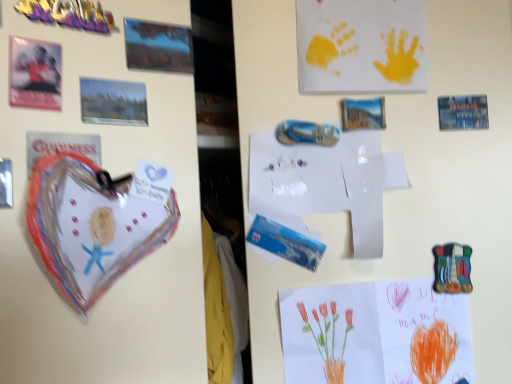
Question: Does watercolor paper flowers at lower right, the 5th postcard from the left, touch matte plastic postcard at upper left, the third postcard positioned from the top?

Choices:
 (A) no
 (B) yes

Answer: (A)

Question: From a real-world perspective, is watercolor paper flowers at lower right, which is the fifth postcard in top-to-bottom order, located beneath matte plastic postcard at upper left, the third postcard ordered from the bottom?

Choices:
 (A) no
 (B) yes

Answer: (B)

Question: Considering the relative positions of watercolor paper flowers at lower right, placed as the 4th postcard when sorted from front to back, and matte plastic postcard at upper left, which ranks as the 5th postcard in back-to-front order, in the image provided, is watercolor paper flowers at lower right, placed as the 4th postcard when sorted from front to back, behind matte plastic postcard at upper left, which ranks as the 5th postcard in back-to-front order,?

Choices:
 (A) no
 (B) yes

Answer: (B)

Question: Considering the relative sizes of watercolor paper flowers at lower right, the 5th postcard from the left, and matte plastic postcard at upper left, the fifth postcard viewed from the right, in the image provided, is watercolor paper flowers at lower right, the 5th postcard from the left, shorter than matte plastic postcard at upper left, the fifth postcard viewed from the right,?

Choices:
 (A) yes
 (B) no

Answer: (B)

Question: Can you confirm if watercolor paper flowers at lower right, which is the fifth postcard in top-to-bottom order, is positioned to the left of matte plastic postcard at upper left, the fifth postcard viewed from the right?

Choices:
 (A) no
 (B) yes

Answer: (A)

Question: Which is correct: metallic postcard at upper left, which is the 3th postcard in left-to-right order, is inside metallic/metallic stickers at upper left, or outside of it?

Choices:
 (A) inside
 (B) outside

Answer: (B)

Question: From the image's perspective, is metallic postcard at upper left, the 3th postcard when ordered from front to back, above or below metallic/metallic stickers at upper left?

Choices:
 (A) below
 (B) above

Answer: (A)

Question: Is point (160, 36) positioned closer to the camera than point (31, 9)?

Choices:
 (A) farther
 (B) closer

Answer: (A)

Question: From a real-world perspective, relative to metallic/metallic stickers at upper left, is metallic postcard at upper left, the third postcard positioned from the back, vertically above or below?

Choices:
 (A) above
 (B) below

Answer: (B)

Question: Looking at the image, does metallic postcard at upper left, which is the second postcard from top to bottom, seem bigger or smaller compared to watercolor paper flowers at lower right, which appears as the first postcard when ordered from the bottom?

Choices:
 (A) small
 (B) big

Answer: (A)

Question: Is metallic postcard at upper left, which is the 3th postcard in left-to-right order, situated inside watercolor paper flowers at lower right, the second postcard in the back-to-front sequence, or outside?

Choices:
 (A) outside
 (B) inside

Answer: (A)

Question: Visually, is metallic postcard at upper left, the third postcard positioned from the back, positioned to the left or to the right of watercolor paper flowers at lower right, which appears as the 1th postcard when viewed from the right?

Choices:
 (A) right
 (B) left

Answer: (B)

Question: In terms of width, does metallic postcard at upper left, which is the 3th postcard in left-to-right order, look wider or thinner when compared to watercolor paper flowers at lower right, placed as the 4th postcard when sorted from front to back?

Choices:
 (A) wide
 (B) thin

Answer: (B)

Question: Based on their positions, is yellow paper handprints at upper center, the 4th postcard viewed from the left, located to the left or right of metallic/metallic stickers at upper left?

Choices:
 (A) right
 (B) left

Answer: (A)

Question: Considering their positions, is yellow paper handprints at upper center, which ranks as the 2th postcard in right-to-left order, located in front of or behind metallic/metallic stickers at upper left?

Choices:
 (A) behind
 (B) front

Answer: (A)